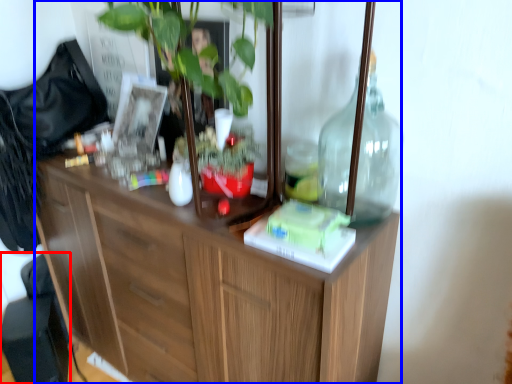
Question: Among these objects, which one is farthest to the camera, swivel chair (highlighted by a red box) or cabinetry (highlighted by a blue box)?

Choices:
 (A) swivel chair
 (B) cabinetry

Answer: (A)